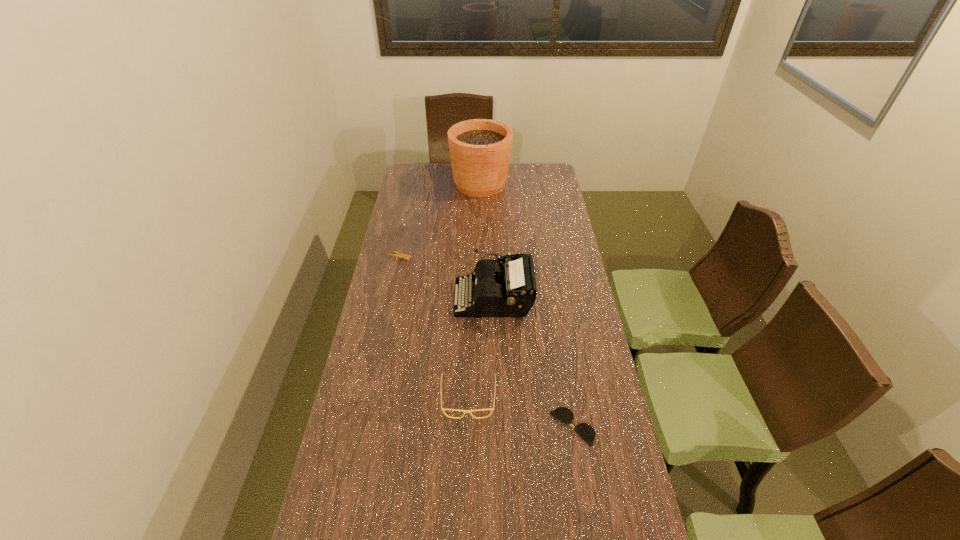
Where is `vacant space located on the left of the tallest object`? This screenshot has height=540, width=960. vacant space located on the left of the tallest object is located at coordinates (415, 184).

Where is `vacant space situated on the typing side of the third farthest object`? vacant space situated on the typing side of the third farthest object is located at coordinates (392, 298).

Identify the location of free space located 0.280m on the typing side of the third farthest object. The height and width of the screenshot is (540, 960). (381, 298).

At what (x,y) coordinates should I click in order to perform the action: click on free space located 0.210m on the typing side of the third farthest object. Please return your answer as a coordinate pair (x, y). Looking at the image, I should click on (399, 298).

This screenshot has height=540, width=960. Find the location of `free region located 0.120m in front of the lenses of the left spectacles`. free region located 0.120m in front of the lenses of the left spectacles is located at coordinates (467, 460).

Image resolution: width=960 pixels, height=540 pixels. What are the coordinates of `free location located 0.270m on the back of the clothespin` in the screenshot? It's located at tap(409, 215).

Where is `vacant space located 0.160m on the front of the shorter spectacles`? vacant space located 0.160m on the front of the shorter spectacles is located at coordinates (586, 508).

Image resolution: width=960 pixels, height=540 pixels. In order to click on object that is at the far edge in this screenshot , I will do `click(480, 149)`.

Locate an element on the screen. The height and width of the screenshot is (540, 960). object that is positioned at the left edge is located at coordinates (399, 255).

The width and height of the screenshot is (960, 540). In order to click on object that is at the right edge in this screenshot , I will do `click(585, 431)`.